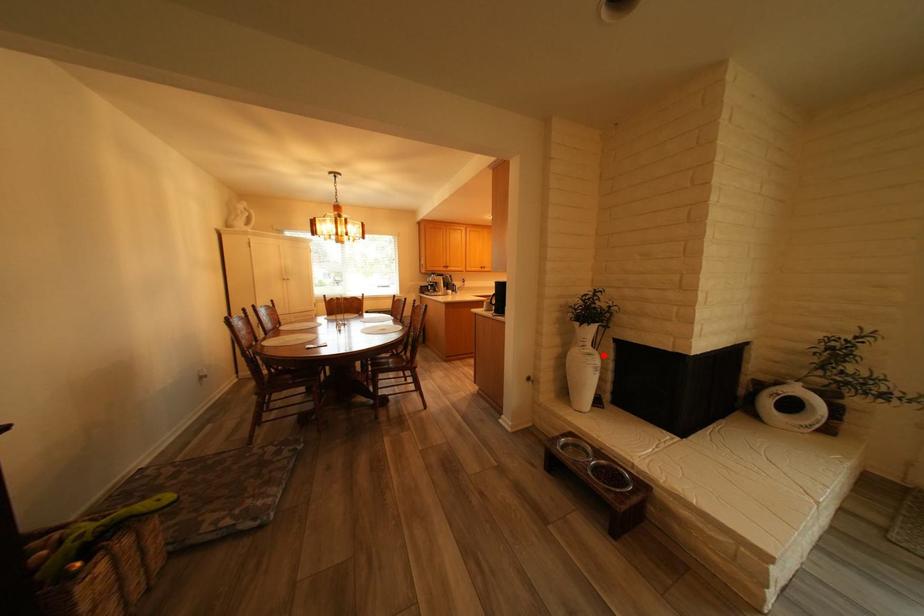
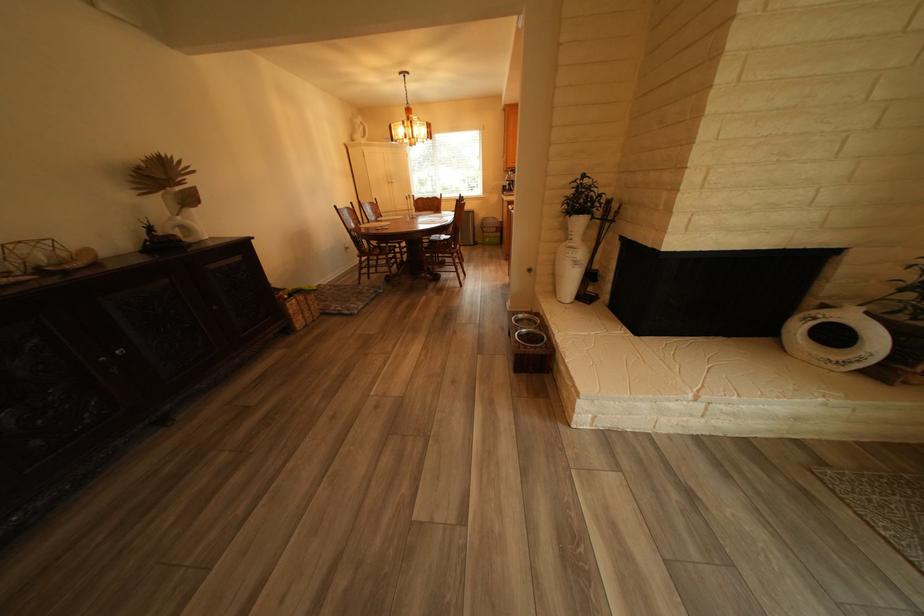
Locate, in the second image, the point that corresponds to the highlighted location in the first image.

(585, 249)